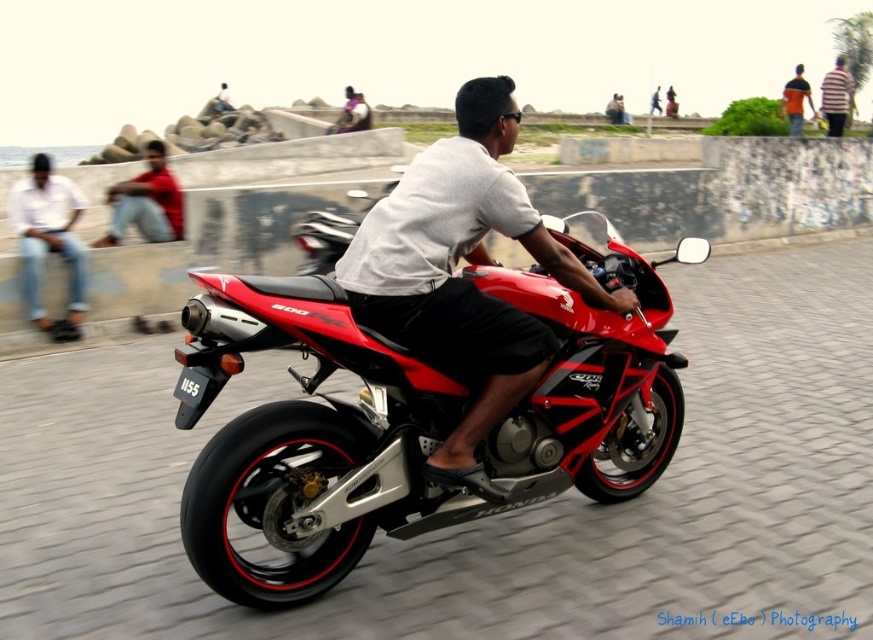
Between point (25, 266) and point (837, 86), which one is positioned behind?

The point (837, 86) is behind.

Between white cotton shirt at left and striped shirt at upper right, which one appears on the left side from the viewer's perspective?

white cotton shirt at left

Between point (83, 256) and point (833, 109), which one is positioned behind?

The point (833, 109) is behind.

The image size is (873, 640). What are the coordinates of `white cotton shirt at left` in the screenshot? It's located at (49, 243).

Is shiny red motorcycle at center taller than orange fabric shirt at upper right?

Yes.

Does point (416, 372) come behind point (794, 104)?

No, it is not.

Locate an element on the screen. shiny red motorcycle at center is located at coordinates (413, 417).

Can you confirm if white cotton shirt at left is wider than matte red shirt at left?

In fact, white cotton shirt at left might be narrower than matte red shirt at left.

Is white cotton shirt at left taller than matte red shirt at left?

No, white cotton shirt at left is not taller than matte red shirt at left.

Describe the element at coordinates (49, 243) in the screenshot. I see `white cotton shirt at left` at that location.

At what (x,y) coordinates should I click in order to perform the action: click on white cotton shirt at left. Please return your answer as a coordinate pair (x, y). Looking at the image, I should click on (49, 243).